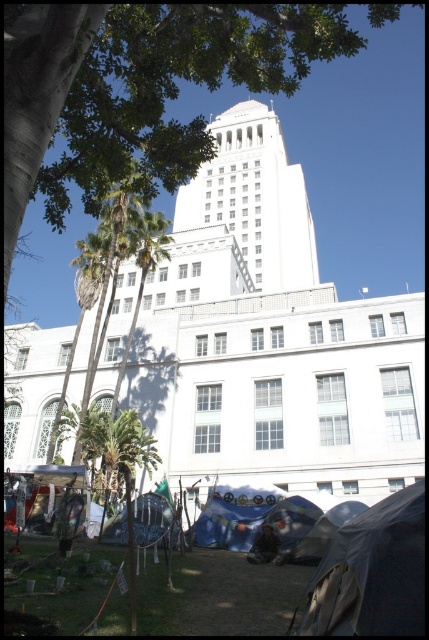
Question: Which object is positioned closest to the transparent plastic tent at lower center?

Choices:
 (A) white marble tower at center
 (B) dark gray fabric tent at lower right
 (C) green leafy tree at upper left
 (D) blue tarp at lower center

Answer: (D)

Question: Is the position of dark gray fabric tent at lower right less distant than that of blue tarp at lower center?

Choices:
 (A) yes
 (B) no

Answer: (A)

Question: Is white marble tower at center in front of dark gray fabric tent at lower right?

Choices:
 (A) yes
 (B) no

Answer: (B)

Question: Is white marble tower at center smaller than transparent plastic tent at lower center?

Choices:
 (A) yes
 (B) no

Answer: (B)

Question: Which object appears farthest from the camera in this image?

Choices:
 (A) dark gray fabric tent at lower right
 (B) white marble tower at center

Answer: (B)

Question: Estimate the real-world distances between objects in this image. Which object is closer to the blue tarp at lower center?

Choices:
 (A) green leafy tree at upper left
 (B) transparent plastic tent at lower center
 (C) dark gray fabric tent at lower right
 (D) white marble tower at center

Answer: (B)